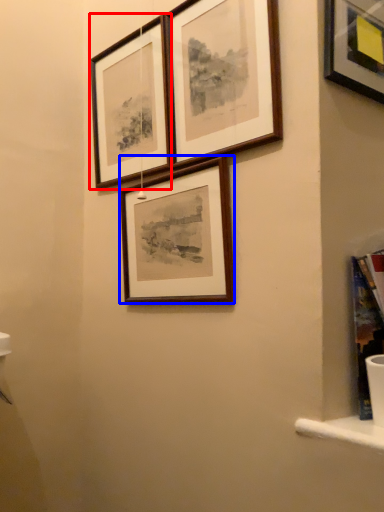
Question: Which object appears closest to the camera in this image, picture frame (highlighted by a red box) or picture frame (highlighted by a blue box)?

Choices:
 (A) picture frame
 (B) picture frame

Answer: (B)